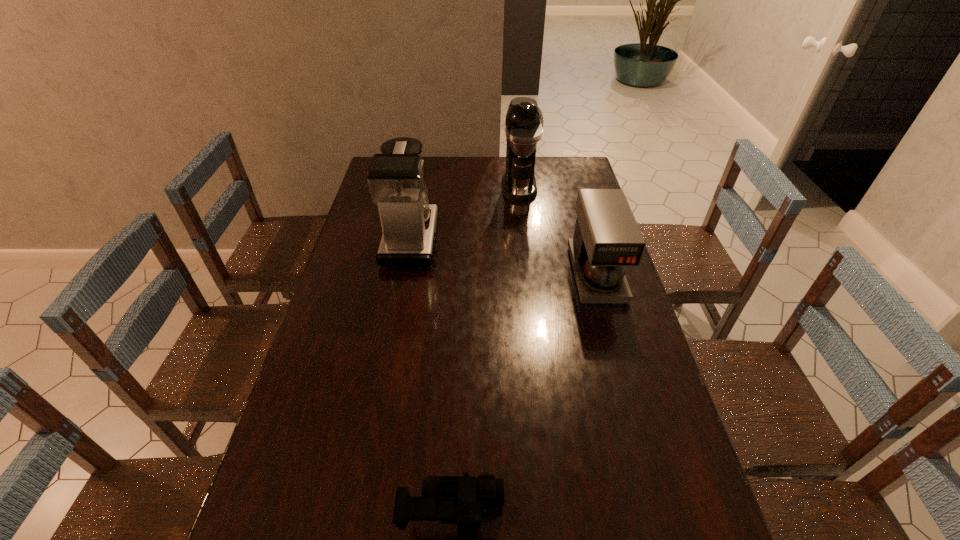
This screenshot has width=960, height=540. I want to click on the second object from right to left, so click(524, 120).

In order to click on the farthest coffee maker in this screenshot , I will do `click(524, 120)`.

The width and height of the screenshot is (960, 540). I want to click on the leftmost coffee maker, so click(395, 178).

This screenshot has height=540, width=960. I want to click on the third tallest object, so [x=607, y=238].

Identify the location of the rightmost coffee maker. This screenshot has height=540, width=960. (607, 238).

Image resolution: width=960 pixels, height=540 pixels. What are the coordinates of `vacant space located 0.110m place cup under the spout of the second coffee maker from left to right` in the screenshot? It's located at (523, 218).

The width and height of the screenshot is (960, 540). I want to click on free space located 0.140m at the front of the leftmost coffee maker where the controls are located, so click(x=478, y=239).

I want to click on vacant area situated on the carafe side of the rightmost object, so click(626, 376).

Where is `object at the far edge`? The height and width of the screenshot is (540, 960). object at the far edge is located at coordinates (524, 120).

You are a GUI agent. You are given a task and a screenshot of the screen. Output one action in this format:
    pyautogui.click(x=<x>, y=<y>)
    Task: Click on the object at the left edge
    The width and height of the screenshot is (960, 540).
    Given the screenshot: What is the action you would take?
    pyautogui.click(x=395, y=178)